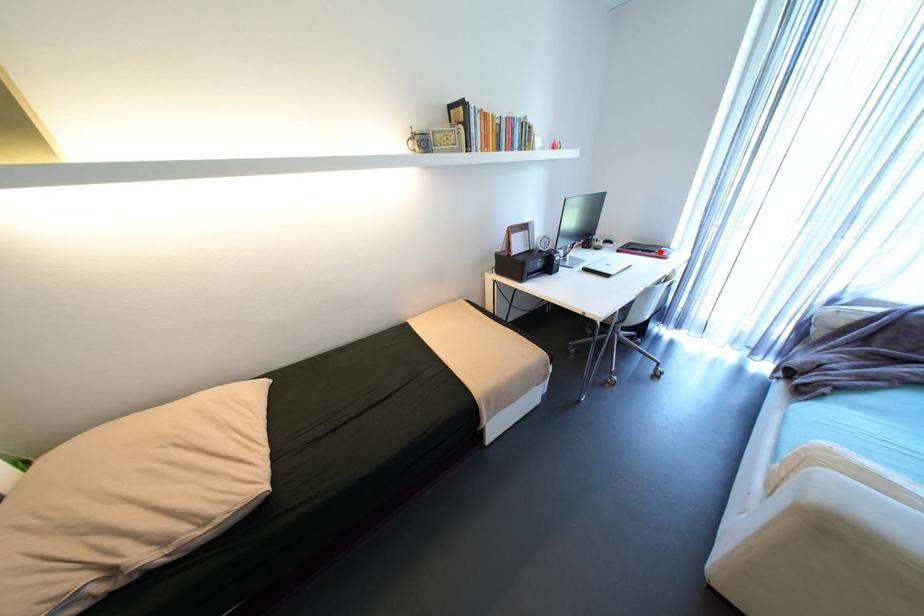
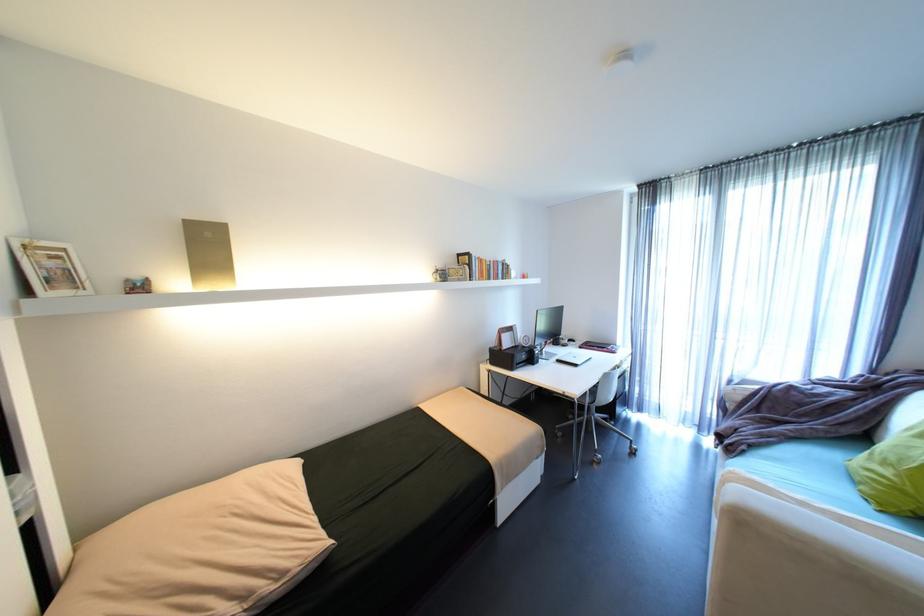
In the second image, find the point that corresponds to the highlighted location in the first image.

(612, 347)